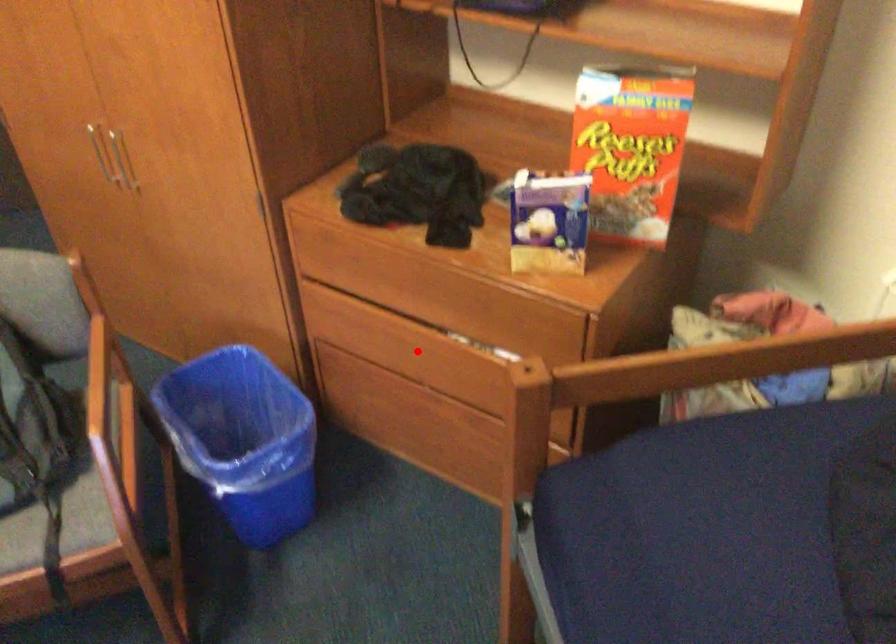
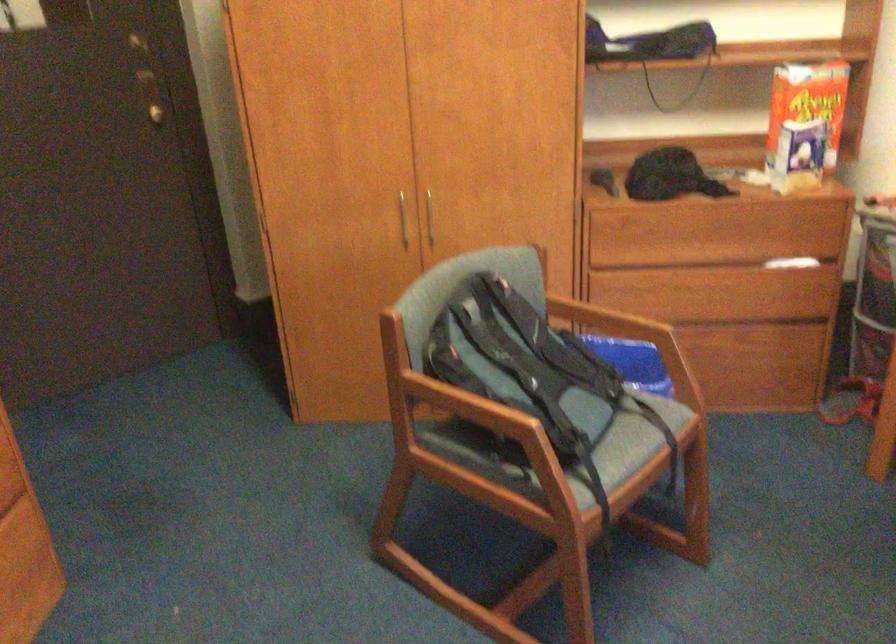
The point at the highlighted location is marked in the first image. Where is the corresponding point in the second image?

(700, 290)